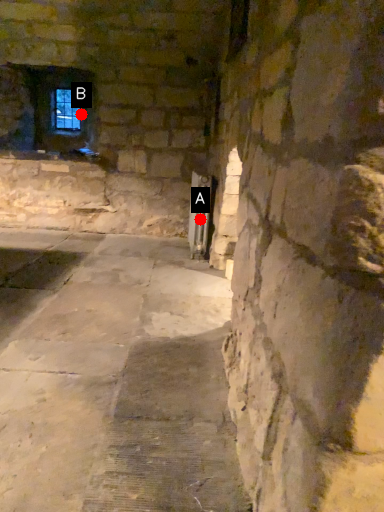
Question: Two points are circled on the image, labeled by A and B beside each circle. Which point is closer to the camera?

Choices:
 (A) A is closer
 (B) B is closer

Answer: (A)